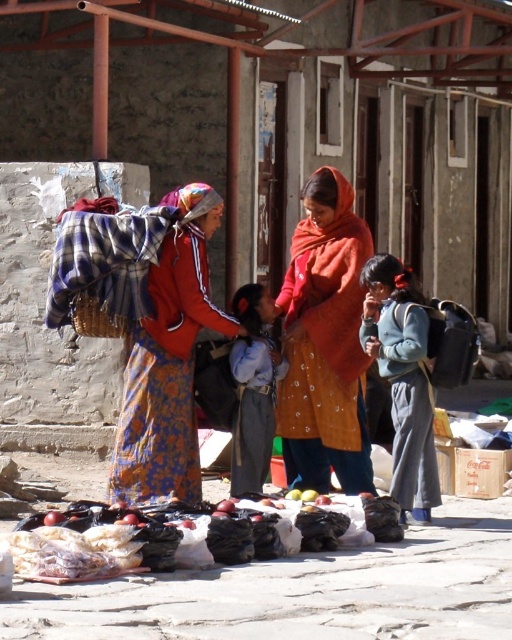
Is the position of blue fabric shirt at center more distant than that of yellow matte apple at center?

Yes, blue fabric shirt at center is behind yellow matte apple at center.

Is blue fabric shirt at center thinner than yellow matte apple at center?

No, blue fabric shirt at center is not thinner than yellow matte apple at center.

The height and width of the screenshot is (640, 512). In order to click on blue fabric shirt at center in this screenshot , I will do `click(253, 388)`.

Image resolution: width=512 pixels, height=640 pixels. What are the coordinates of `blue fabric shirt at center` in the screenshot? It's located at (253, 388).

Which is more to the left, orange fabric shawl at center or blue fabric shirt at center?

Positioned to the left is blue fabric shirt at center.

Where is `orange fabric shawl at center`? The height and width of the screenshot is (640, 512). orange fabric shawl at center is located at coordinates (325, 342).

Can you confirm if shiny plastic bags at lower center is positioned below blue denim jacket at center?

Correct, shiny plastic bags at lower center is located below blue denim jacket at center.

Between shiny plastic bags at lower center and blue denim jacket at center, which one is positioned higher?

blue denim jacket at center is above.

Does point (330, 536) come farther from viewer compared to point (415, 396)?

That is False.

Find the location of `shiny plastic bags at lower center`. shiny plastic bags at lower center is located at coordinates (136, 540).